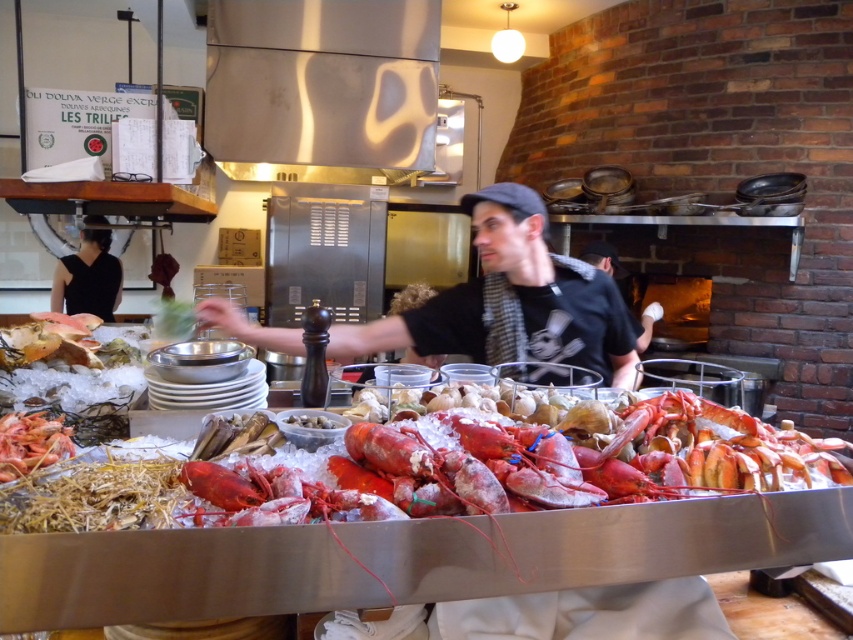
Consider the image. You are standing in the seafood market and want to pick up an item located at point (83, 288) and another item at point (300, 426). Which item will be easier to reach without moving your position?

The item at point (83, 288) will be easier to reach because it is closer to you compared to the item at point (300, 426).

You are a chef preparing a seafood platter and need to choose between the shiny red lobster at center and the white matte shell at center. Which one is larger in size?

The shiny red lobster at center is bigger than the white matte shell at center, so the shiny red lobster at center is the larger option.

You are a chef trying to grab the shiny red lobster at center and the white matte shell at center from the counter. Which one is closer to you?

The shiny red lobster at center is closer to you than the white matte shell at center, so you can grab it first.